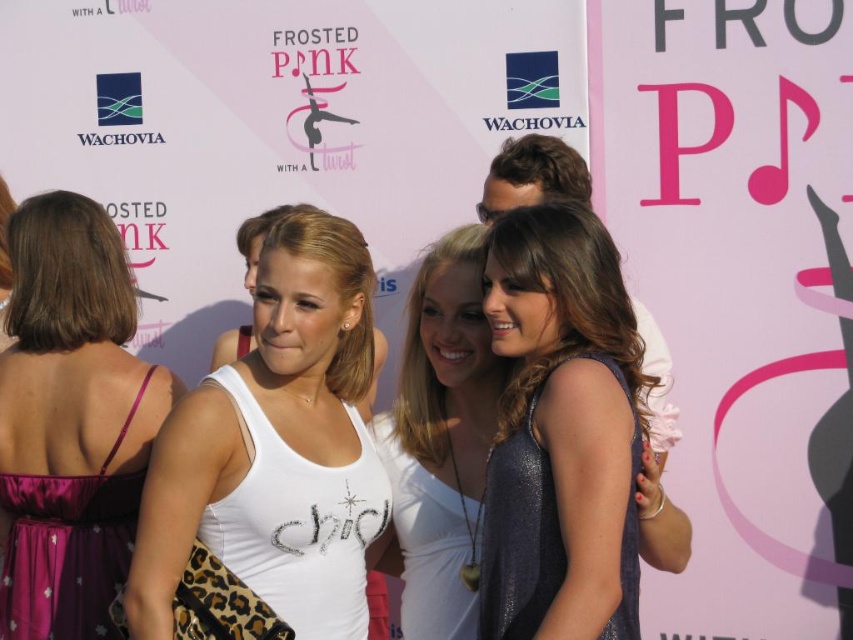
Looking at this image, can you confirm if white matte tank top at center is positioned to the left of white fabric shirt at center?

Correct, you'll find white matte tank top at center to the left of white fabric shirt at center.

The width and height of the screenshot is (853, 640). I want to click on white matte tank top at center, so click(279, 444).

Is shiny blue dress at center to the left of purple satin dress at left from the viewer's perspective?

Incorrect, shiny blue dress at center is not on the left side of purple satin dress at left.

Who is shorter, shiny blue dress at center or purple satin dress at left?

shiny blue dress at center is shorter.

Is point (573, 209) closer to camera compared to point (56, 552)?

Yes.

The image size is (853, 640). Identify the location of shiny blue dress at center. (567, 438).

Is point (544, 262) farther from viewer compared to point (194, 419)?

That is False.

The image size is (853, 640). What do you see at coordinates (567, 438) in the screenshot? I see `shiny blue dress at center` at bounding box center [567, 438].

Is point (515, 572) closer to viewer compared to point (315, 595)?

Yes, point (515, 572) is closer to viewer.

At what (x,y) coordinates should I click in order to perform the action: click on shiny blue dress at center. Please return your answer as a coordinate pair (x, y). This screenshot has width=853, height=640. Looking at the image, I should click on (567, 438).